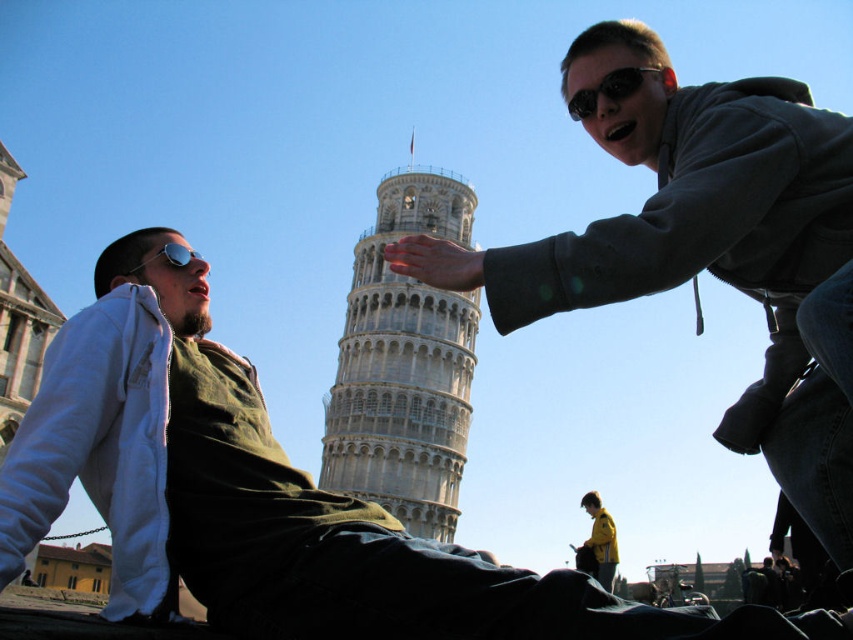
You are standing at the point labeled as point (340, 392) and want to take a photo of the Leaning Tower of Pisa. There is a person at point (442, 563) blocking your view. Can you move to a position where you can see the tower without the person blocking it?

Point (442, 563) is in front of point (340, 392), so if you move behind point (340, 392), you can see the Leaning Tower of Pisa without the person blocking your view.

You are standing in the Piazza dei Miracoli and see the Leaning Tower of Pisa in the background and the matte black jacket at center. If you want to take a photo that includes both the tower and the jacket, which direction should you move to ensure both are in frame?

To include both the Leaning Tower of Pisa and the matte black jacket at center in your photo, you should move closer to the matte black jacket at center. Since the matte black jacket at center is 107.13 feet away from the viewer, moving closer will bring it nearer while still keeping the tower in the background within the frame.